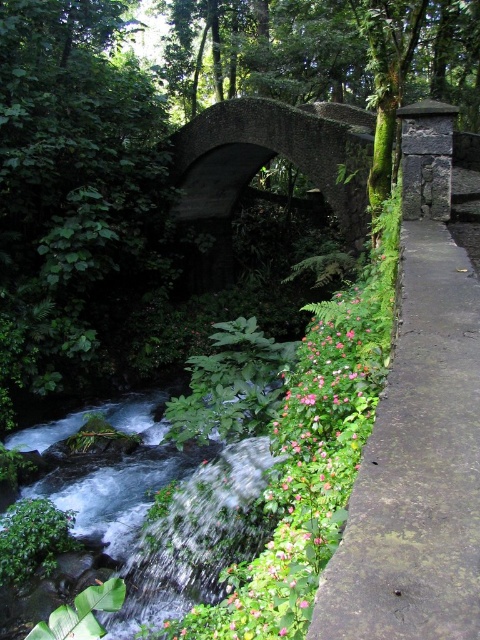
Which is behind, point (296, 419) or point (230, 150)?

The point (230, 150) is behind.

Does point (300, 484) come in front of point (364, 221)?

Yes, it is.

The height and width of the screenshot is (640, 480). Find the location of `pink matte flowers at center`. pink matte flowers at center is located at coordinates (304, 476).

From the picture: Which is above, green mossy concrete pavement at right or dark gray stone bridge at center?

dark gray stone bridge at center

Identify the location of green mossy concrete pavement at right. The width and height of the screenshot is (480, 640). (417, 467).

Which is in front, point (391, 616) or point (201, 609)?

Point (391, 616)

Between green mossy concrete pavement at right and pink matte flowers at center, which one has more height?

Standing taller between the two is pink matte flowers at center.

You are a GUI agent. You are given a task and a screenshot of the screen. Output one action in this format:
    pyautogui.click(x=<x>, y=<y>)
    Task: Click on the green mossy concrete pavement at right
    The image size is (480, 640).
    Given the screenshot: What is the action you would take?
    pyautogui.click(x=417, y=467)